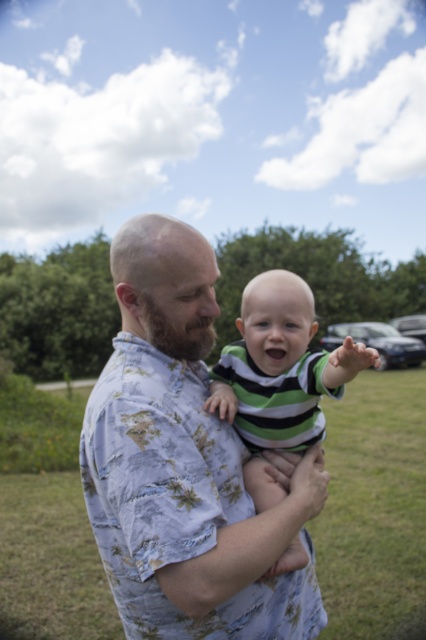
Who is more forward, (x=261, y=608) or (x=351, y=353)?

Positioned in front is point (x=351, y=353).

Does floral cotton shirt at center lie behind green striped shirt at center?

No, floral cotton shirt at center is in front of green striped shirt at center.

Locate an element on the screen. This screenshot has width=426, height=640. floral cotton shirt at center is located at coordinates (184, 465).